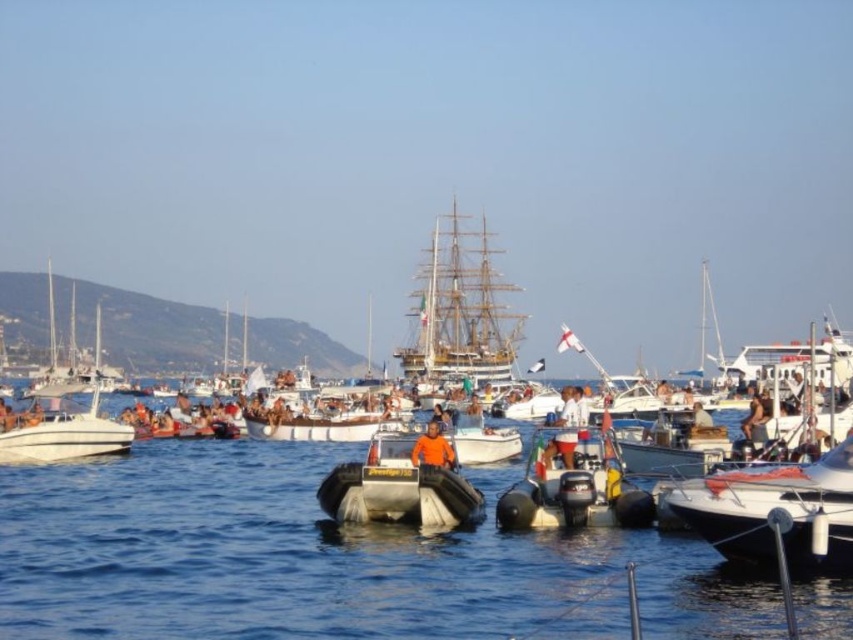
Does white glossy motorboat at right have a larger size compared to silver metallic dinghy at center?

Correct, white glossy motorboat at right is larger in size than silver metallic dinghy at center.

Which is behind, point (746, 522) or point (361, 484)?

Point (361, 484)

Is point (688, 512) closer to viewer compared to point (374, 516)?

Yes, point (688, 512) is in front of point (374, 516).

You are a GUI agent. You are given a task and a screenshot of the screen. Output one action in this format:
    pyautogui.click(x=<x>, y=<y>)
    Task: Click on the white glossy motorboat at right
    
    Given the screenshot: What is the action you would take?
    pyautogui.click(x=775, y=508)

Is white glossy motorboat at right bigger than orange fabric shirt at center?

Yes, white glossy motorboat at right is bigger than orange fabric shirt at center.

Can you confirm if white glossy motorboat at right is shorter than orange fabric shirt at center?

No, white glossy motorboat at right is not shorter than orange fabric shirt at center.

The width and height of the screenshot is (853, 640). Describe the element at coordinates (775, 508) in the screenshot. I see `white glossy motorboat at right` at that location.

Image resolution: width=853 pixels, height=640 pixels. I want to click on white glossy motorboat at right, so click(x=775, y=508).

The width and height of the screenshot is (853, 640). What do you see at coordinates (461, 312) in the screenshot?
I see `wooden ship at center` at bounding box center [461, 312].

Does point (473, 250) come farther from viewer compared to point (434, 433)?

Yes.

In order to click on wooden ship at center in this screenshot , I will do `click(461, 312)`.